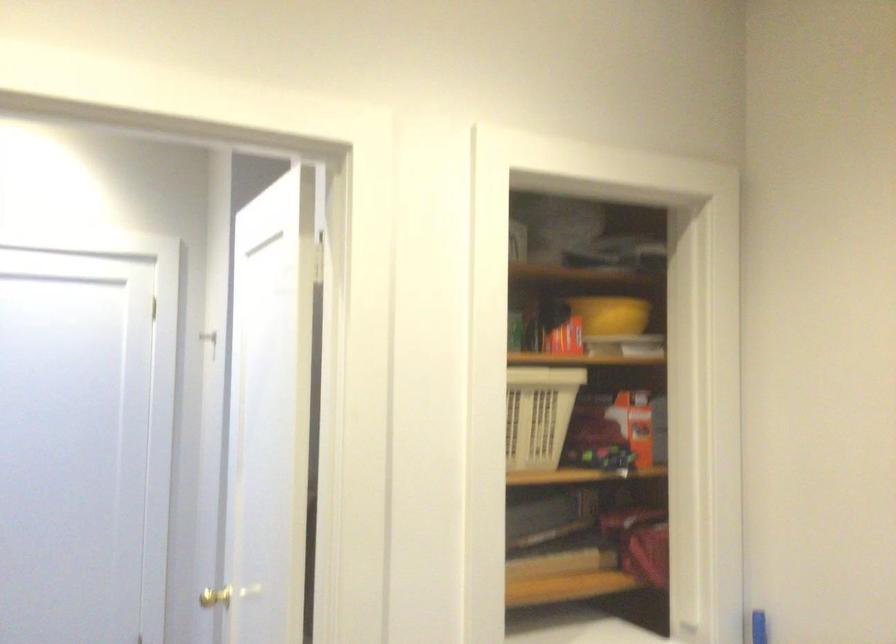
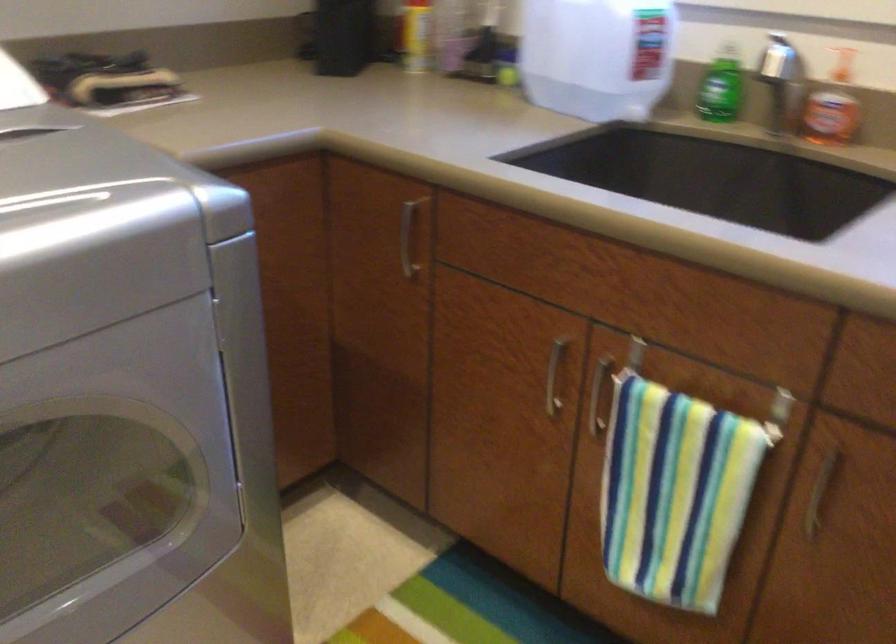
The first image is from the beginning of the video and the second image is from the end. How did the camera likely rotate when shooting the video?

The camera rotated toward right-down.